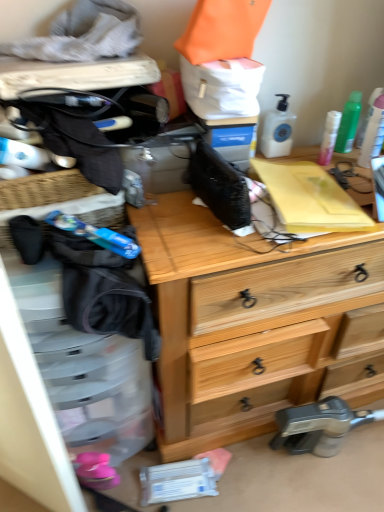
Locate an element on the screen. The height and width of the screenshot is (512, 384). wooden chest of drawers at center is located at coordinates (251, 322).

Image resolution: width=384 pixels, height=512 pixels. Identify the location of pink matte lotion at upper right, the 3th toiletry viewed from the right. (329, 137).

The height and width of the screenshot is (512, 384). What do you see at coordinates (349, 123) in the screenshot? I see `green matte spray can at upper right, the 3th toiletry from the left` at bounding box center [349, 123].

This screenshot has height=512, width=384. Describe the element at coordinates (278, 130) in the screenshot. I see `white plastic pump bottle at upper right, arranged as the 4th toiletry when viewed from the right` at that location.

The width and height of the screenshot is (384, 512). What are the coordinates of `green plastic spray can at upper right, marked as the 1th toiletry in a right-to-left arrangement` in the screenshot? It's located at (373, 134).

From the image's perspective, relative to green plastic spray can at upper right, acting as the fourth toiletry starting from the left, is green matte spray can at upper right, the second toiletry when ordered from right to left, above or below?

green matte spray can at upper right, the second toiletry when ordered from right to left, is above green plastic spray can at upper right, acting as the fourth toiletry starting from the left.

From a real-world perspective, is green matte spray can at upper right, the second toiletry when ordered from right to left, positioned above or below green plastic spray can at upper right, marked as the 1th toiletry in a right-to-left arrangement?

green matte spray can at upper right, the second toiletry when ordered from right to left, is situated lower than green plastic spray can at upper right, marked as the 1th toiletry in a right-to-left arrangement, in the real world.

Considering the positions of objects green matte spray can at upper right, the 3th toiletry from the left, and green plastic spray can at upper right, acting as the fourth toiletry starting from the left, in the image provided, who is more to the right, green matte spray can at upper right, the 3th toiletry from the left, or green plastic spray can at upper right, acting as the fourth toiletry starting from the left,?

From the viewer's perspective, green plastic spray can at upper right, acting as the fourth toiletry starting from the left, appears more on the right side.

Where is `toiletry that is the 3rd object located behind the green plastic spray can at upper right, marked as the 1th toiletry in a right-to-left arrangement`? toiletry that is the 3rd object located behind the green plastic spray can at upper right, marked as the 1th toiletry in a right-to-left arrangement is located at coordinates (349, 123).

Is pink matte lotion at upper right, the 3th toiletry viewed from the right, not within wooden chest of drawers at center?

Absolutely, pink matte lotion at upper right, the 3th toiletry viewed from the right, is external to wooden chest of drawers at center.

Is there a large distance between pink matte lotion at upper right, marked as the second toiletry in a left-to-right arrangement, and wooden chest of drawers at center?

No, pink matte lotion at upper right, marked as the second toiletry in a left-to-right arrangement, is not far from wooden chest of drawers at center.

From the image's perspective, is pink matte lotion at upper right, the 3th toiletry viewed from the right, above or below wooden chest of drawers at center?

Based on their image positions, pink matte lotion at upper right, the 3th toiletry viewed from the right, is located above wooden chest of drawers at center.

How different are the orientations of pink matte lotion at upper right, the 3th toiletry viewed from the right, and wooden chest of drawers at center in degrees?

The angle between the facing direction of pink matte lotion at upper right, the 3th toiletry viewed from the right, and the facing direction of wooden chest of drawers at center is 7.32 degrees.

From the picture: What's the angular difference between white plastic pump bottle at upper right, arranged as the 4th toiletry when viewed from the right, and pink matte lotion at upper right, marked as the second toiletry in a left-to-right arrangement,'s facing directions?

white plastic pump bottle at upper right, arranged as the 4th toiletry when viewed from the right, and pink matte lotion at upper right, marked as the second toiletry in a left-to-right arrangement, are facing 2.84 degrees away from each other.

Considering the relative sizes of white plastic pump bottle at upper right, the first toiletry from the left, and pink matte lotion at upper right, the 3th toiletry viewed from the right, in the image provided, is white plastic pump bottle at upper right, the first toiletry from the left, taller than pink matte lotion at upper right, the 3th toiletry viewed from the right,?

Indeed, white plastic pump bottle at upper right, the first toiletry from the left, has a greater height compared to pink matte lotion at upper right, the 3th toiletry viewed from the right.

Which is further, [263,128] or [329,121]?

Point [263,128]

Is green matte spray can at upper right, the second toiletry when ordered from right to left, far away from pink matte lotion at upper right, the 3th toiletry viewed from the right?

No, green matte spray can at upper right, the second toiletry when ordered from right to left, is not far away from pink matte lotion at upper right, the 3th toiletry viewed from the right.

Could pink matte lotion at upper right, the 3th toiletry viewed from the right, be considered to be inside green matte spray can at upper right, the second toiletry when ordered from right to left?

No.

Does point (358, 94) appear closer or farther from the camera than point (330, 146)?

Clearly, point (358, 94) is more distant from the camera than point (330, 146).

Considering the relative positions of green matte spray can at upper right, the second toiletry when ordered from right to left, and pink matte lotion at upper right, the 3th toiletry viewed from the right, in the image provided, is green matte spray can at upper right, the second toiletry when ordered from right to left, to the right of pink matte lotion at upper right, the 3th toiletry viewed from the right, from the viewer's perspective?

Indeed, green matte spray can at upper right, the second toiletry when ordered from right to left, is positioned on the right side of pink matte lotion at upper right, the 3th toiletry viewed from the right.

Does wooden chest of drawers at center have a smaller size compared to green matte spray can at upper right, the 3th toiletry from the left?

No.

From a real-world perspective, is wooden chest of drawers at center positioned above or below green matte spray can at upper right, the 3th toiletry from the left?

Clearly, from a real-world perspective, wooden chest of drawers at center is below green matte spray can at upper right, the 3th toiletry from the left.

From the image's perspective, is wooden chest of drawers at center above green matte spray can at upper right, the second toiletry when ordered from right to left?

No, from the image's perspective, wooden chest of drawers at center is not above green matte spray can at upper right, the second toiletry when ordered from right to left.

Is wooden chest of drawers at center wider or thinner than green matte spray can at upper right, the second toiletry when ordered from right to left?

Result: wooden chest of drawers at center is wider than green matte spray can at upper right, the second toiletry when ordered from right to left.

Which point is more distant from viewer, (379, 142) or (279, 154)?

The point (279, 154) is farther from the camera.

Considering the sizes of objects green plastic spray can at upper right, marked as the 1th toiletry in a right-to-left arrangement, and white plastic pump bottle at upper right, arranged as the 4th toiletry when viewed from the right, in the image provided, who is smaller, green plastic spray can at upper right, marked as the 1th toiletry in a right-to-left arrangement, or white plastic pump bottle at upper right, arranged as the 4th toiletry when viewed from the right,?

Smaller between the two is green plastic spray can at upper right, marked as the 1th toiletry in a right-to-left arrangement.

Find the location of a particular element. This screenshot has height=512, width=384. toiletry that is the 3rd object to the left of the green plastic spray can at upper right, acting as the fourth toiletry starting from the left, starting at the anchor is located at coordinates (278, 130).

Do you think green matte spray can at upper right, the second toiletry when ordered from right to left, is within wooden chest of drawers at center, or outside of it?

green matte spray can at upper right, the second toiletry when ordered from right to left, cannot be found inside wooden chest of drawers at center.

Does green matte spray can at upper right, the second toiletry when ordered from right to left, touch wooden chest of drawers at center?

No, green matte spray can at upper right, the second toiletry when ordered from right to left, is not making contact with wooden chest of drawers at center.

Is green matte spray can at upper right, the second toiletry when ordered from right to left, shorter than wooden chest of drawers at center?

Yes, green matte spray can at upper right, the second toiletry when ordered from right to left, is shorter than wooden chest of drawers at center.

Can you confirm if green matte spray can at upper right, the second toiletry when ordered from right to left, is smaller than wooden chest of drawers at center?

Correct, green matte spray can at upper right, the second toiletry when ordered from right to left, occupies less space than wooden chest of drawers at center.

From the image's perspective, starting from the green matte spray can at upper right, the second toiletry when ordered from right to left, which toiletry is the 2nd one below? Please provide its 2D coordinates.

[(373, 134)]

This screenshot has width=384, height=512. Identify the location of chest of drawers on the right of pink matte lotion at upper right, marked as the second toiletry in a left-to-right arrangement. (251, 322).

Which object lies nearer to the anchor point white plastic pump bottle at upper right, the first toiletry from the left, wooden chest of drawers at center or green matte spray can at upper right, the 3th toiletry from the left?

green matte spray can at upper right, the 3th toiletry from the left, lies closer to white plastic pump bottle at upper right, the first toiletry from the left, than the other object.

Based on the photo, estimate the real-world distances between objects in this image. Which object is further from white plastic pump bottle at upper right, the first toiletry from the left, pink matte lotion at upper right, marked as the second toiletry in a left-to-right arrangement, or green matte spray can at upper right, the 3th toiletry from the left?

green matte spray can at upper right, the 3th toiletry from the left.

When comparing their distances from pink matte lotion at upper right, the 3th toiletry viewed from the right, does white plastic pump bottle at upper right, arranged as the 4th toiletry when viewed from the right, or green matte spray can at upper right, the 3th toiletry from the left, seem closer?

green matte spray can at upper right, the 3th toiletry from the left, is positioned closer to the anchor pink matte lotion at upper right, the 3th toiletry viewed from the right.

From the image, which object appears to be farther from green matte spray can at upper right, the 3th toiletry from the left, wooden chest of drawers at center or white plastic pump bottle at upper right, arranged as the 4th toiletry when viewed from the right?

Based on the image, wooden chest of drawers at center appears to be further to green matte spray can at upper right, the 3th toiletry from the left.

Which object lies further to the anchor point green matte spray can at upper right, the second toiletry when ordered from right to left, white plastic pump bottle at upper right, the first toiletry from the left, or wooden chest of drawers at center?

The object further to green matte spray can at upper right, the second toiletry when ordered from right to left, is wooden chest of drawers at center.

When comparing their distances from wooden chest of drawers at center, does white plastic pump bottle at upper right, arranged as the 4th toiletry when viewed from the right, or green plastic spray can at upper right, acting as the fourth toiletry starting from the left, seem closer?

white plastic pump bottle at upper right, arranged as the 4th toiletry when viewed from the right, is positioned closer to the anchor wooden chest of drawers at center.

Based on their spatial positions, is wooden chest of drawers at center or green plastic spray can at upper right, marked as the 1th toiletry in a right-to-left arrangement, further from pink matte lotion at upper right, marked as the second toiletry in a left-to-right arrangement?

The object further to pink matte lotion at upper right, marked as the second toiletry in a left-to-right arrangement, is wooden chest of drawers at center.

From the image, which object appears to be nearer to green matte spray can at upper right, the second toiletry when ordered from right to left, green plastic spray can at upper right, acting as the fourth toiletry starting from the left, or pink matte lotion at upper right, marked as the second toiletry in a left-to-right arrangement?

Based on the image, pink matte lotion at upper right, marked as the second toiletry in a left-to-right arrangement, appears to be nearer to green matte spray can at upper right, the second toiletry when ordered from right to left.

Where is `toiletry between green plastic spray can at upper right, acting as the fourth toiletry starting from the left, and wooden chest of drawers at center from top to bottom`? Image resolution: width=384 pixels, height=512 pixels. toiletry between green plastic spray can at upper right, acting as the fourth toiletry starting from the left, and wooden chest of drawers at center from top to bottom is located at coordinates (329, 137).

This screenshot has height=512, width=384. Identify the location of toiletry between pink matte lotion at upper right, the 3th toiletry viewed from the right, and green plastic spray can at upper right, acting as the fourth toiletry starting from the left. (349, 123).

The width and height of the screenshot is (384, 512). In order to click on toiletry located between white plastic pump bottle at upper right, the first toiletry from the left, and green matte spray can at upper right, the 3th toiletry from the left, in the left-right direction in this screenshot , I will do `click(329, 137)`.